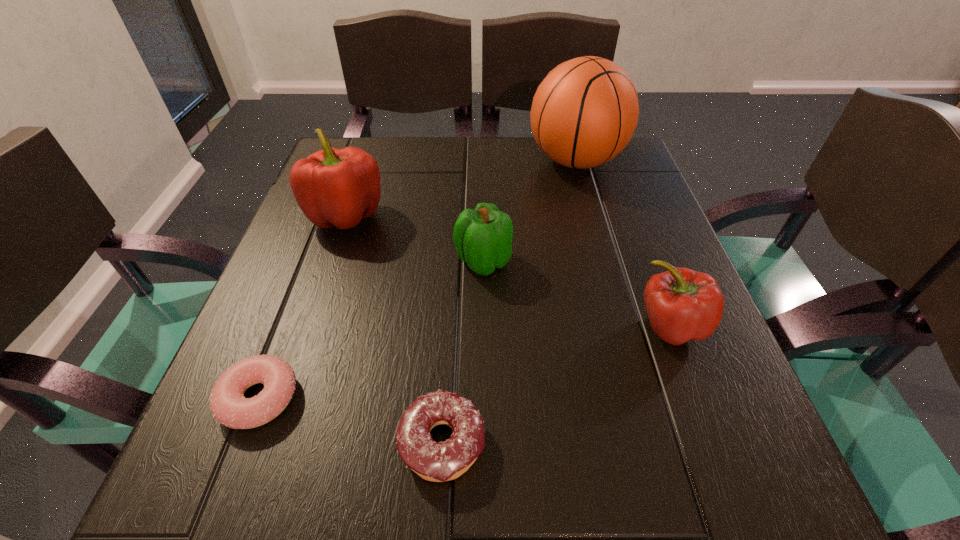
Where is `basketball`? basketball is located at coordinates (585, 111).

You are a GUI agent. You are given a task and a screenshot of the screen. Output one action in this format:
    pyautogui.click(x=<x>, y=<y>)
    Task: Click on the farthest object
    This screenshot has width=960, height=540.
    Given the screenshot: What is the action you would take?
    pyautogui.click(x=585, y=111)

Locate an element on the screen. This screenshot has height=540, width=960. the second farthest object is located at coordinates (335, 187).

At what (x,y) coordinates should I click in order to perform the action: click on the leftmost bell pepper. Please return your answer as a coordinate pair (x, y). Looking at the image, I should click on (335, 187).

The image size is (960, 540). Find the location of `the second nearest bell pepper`. the second nearest bell pepper is located at coordinates (483, 237).

I want to click on the second bell pepper from left to right, so click(x=483, y=237).

Where is `the rightmost bell pepper`? The height and width of the screenshot is (540, 960). the rightmost bell pepper is located at coordinates coord(682,304).

Identify the location of the nearest bell pepper. The width and height of the screenshot is (960, 540). [x=682, y=304].

Identify the location of the right doughnut. (438, 462).

Identify the location of the fifth tallest object. (438, 462).